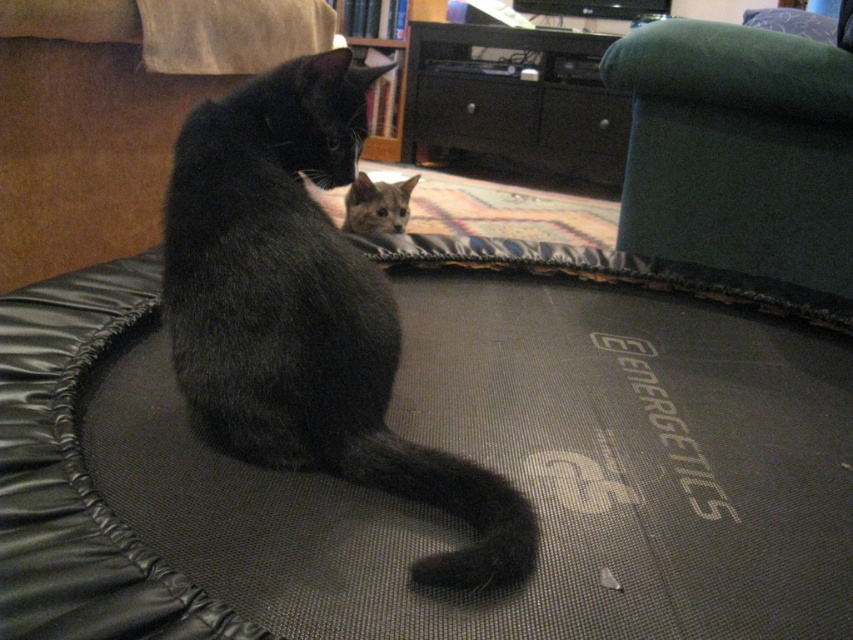
Question: Estimate the real-world distances between objects in this image. Which object is farther from the black matte fur cat at center?

Choices:
 (A) black fabric dog bed at center
 (B) green fabric bean bag at upper right

Answer: (B)

Question: Is green fabric bean bag at upper right below gray fur cat at center?

Choices:
 (A) yes
 (B) no

Answer: (A)

Question: Considering the real-world distances, which object is farthest from the black matte fur cat at center?

Choices:
 (A) black fabric dog bed at center
 (B) gray fur cat at center

Answer: (B)

Question: Can you confirm if green fabric bean bag at upper right is bigger than gray fur cat at center?

Choices:
 (A) no
 (B) yes

Answer: (B)

Question: Is black fabric dog bed at center bigger than gray fur cat at center?

Choices:
 (A) yes
 (B) no

Answer: (A)

Question: Which is nearer to the black fabric dog bed at center?

Choices:
 (A) green fabric bean bag at upper right
 (B) black matte fur cat at center
 (C) gray fur cat at center

Answer: (B)